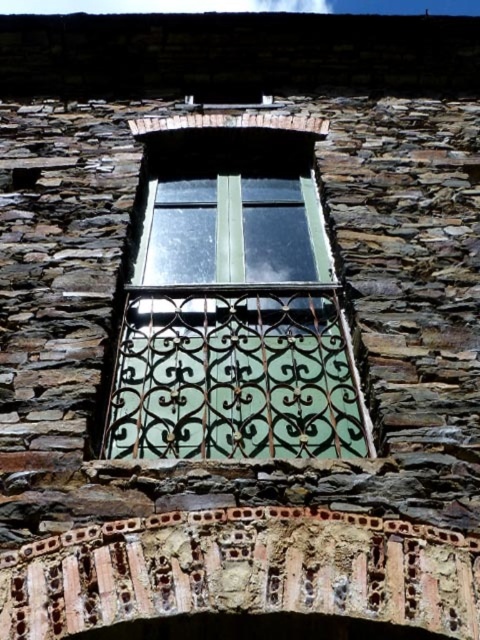
What are the coordinates of the green matte glass window at center?

The green matte glass window at center is located at coordinates point [233,301].

You are a painter standing at the base of the stone wall. You need to paint both the green matte glass window at center and the rusty metal balcony at center. Given that your ladder can reach up to 10 meters, can you safely paint both objects without moving the ladder?

The green matte glass window at center and the rusty metal balcony at center are 13.16 meters apart. Since your ladder can only reach up to 10 meters, you cannot safely paint both objects without moving the ladder because the distance between them exceeds the ladder height limit.

You are a painter standing on the rusty metal balcony at center, looking up at the green matte glass window at center. Can you reach the window from your current position?

The green matte glass window at center is positioned over the rusty metal balcony at center, so yes, you can reach the window from the balcony.